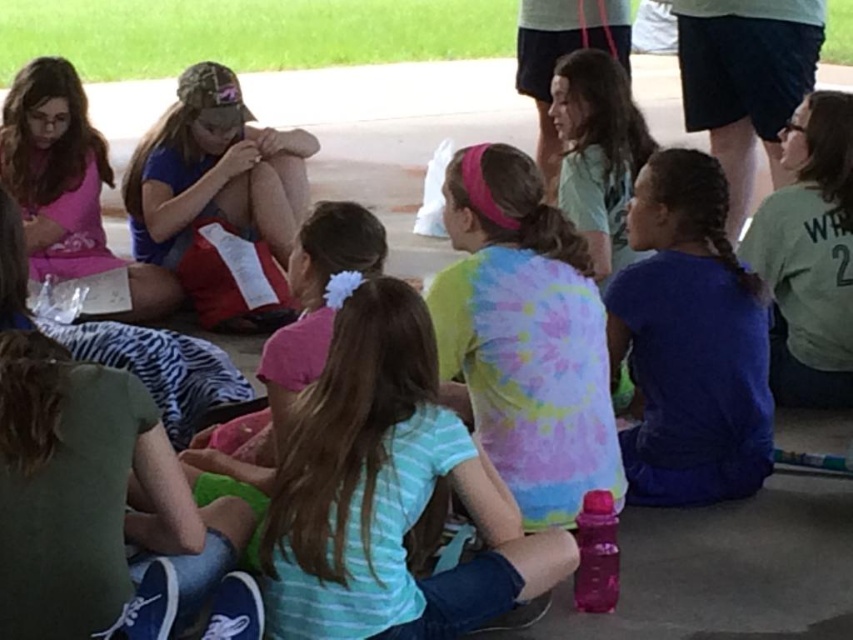
Can you confirm if matte blue shirt at center is bigger than matte pink shirt at upper left?

Indeed, matte blue shirt at center has a larger size compared to matte pink shirt at upper left.

Is point (236, 145) less distant than point (88, 225)?

Yes, it is in front of point (88, 225).

At what (x,y) coordinates should I click in order to perform the action: click on matte blue shirt at center. Please return your answer as a coordinate pair (x, y). Looking at the image, I should click on (219, 202).

Is striped cotton shirt at center shorter than green jersey at right?

Yes, striped cotton shirt at center is shorter than green jersey at right.

Measure the distance from striped cotton shirt at center to green jersey at right.

1.88 meters

Is point (347, 368) positioned in front of point (773, 294)?

Yes, point (347, 368) is closer to viewer.

The height and width of the screenshot is (640, 853). I want to click on striped cotton shirt at center, so click(387, 493).

Who is positioned more to the left, blue fabric shirt at center or green jersey at right?

Positioned to the left is blue fabric shirt at center.

Does blue fabric shirt at center have a lesser height compared to green jersey at right?

Yes, blue fabric shirt at center is shorter than green jersey at right.

Is point (746, 397) behind point (820, 308)?

No, it is in front of (820, 308).

Image resolution: width=853 pixels, height=640 pixels. Find the location of `blue fabric shirt at center`. blue fabric shirt at center is located at coordinates (689, 342).